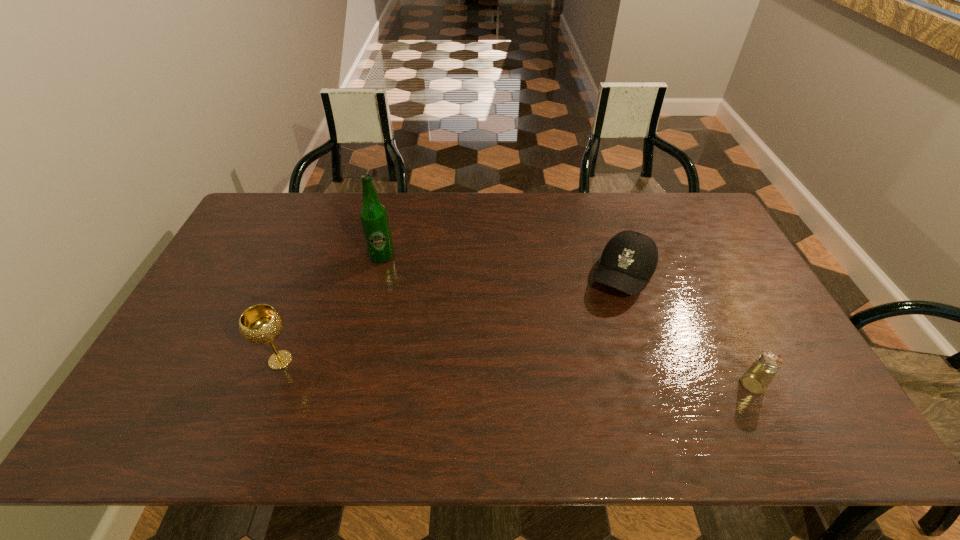
You are a GUI agent. You are given a task and a screenshot of the screen. Output one action in this format:
    pyautogui.click(x=<x>, y=<y>)
    Task: Click on the free space at the left edge of the desktop
    The width and height of the screenshot is (960, 540).
    Given the screenshot: What is the action you would take?
    pyautogui.click(x=259, y=278)

Locate an element on the screen. free space at the right edge is located at coordinates (763, 300).

The height and width of the screenshot is (540, 960). I want to click on vacant space at the far right corner of the desktop, so click(x=680, y=212).

Find the location of a particular element. This screenshot has width=960, height=540. unoccupied position between the saltshaker and the second tallest object is located at coordinates (516, 373).

You are a GUI agent. You are given a task and a screenshot of the screen. Output one action in this format:
    pyautogui.click(x=<x>, y=<y>)
    Task: Click on the free space that is in between the tallest object and the rightmost object
    The image size is (960, 540).
    Given the screenshot: What is the action you would take?
    pyautogui.click(x=567, y=320)

You are a GUI agent. You are given a task and a screenshot of the screen. Output one action in this format:
    pyautogui.click(x=<x>, y=<y>)
    Task: Click on the unoccupied position between the rightmost object and the chalice
    
    Given the screenshot: What is the action you would take?
    pyautogui.click(x=516, y=373)

Locate an element on the screen. The width and height of the screenshot is (960, 540). free point between the saltshaker and the tallest object is located at coordinates (567, 320).

Find the location of a particular element. This screenshot has height=540, width=960. free space between the beer bottle and the saltshaker is located at coordinates (567, 320).

Where is `blank region between the saltshaker and the tallest object`? blank region between the saltshaker and the tallest object is located at coordinates (567, 320).

Find the location of `empty location between the beer bottle and the saltshaker`. empty location between the beer bottle and the saltshaker is located at coordinates (567, 320).